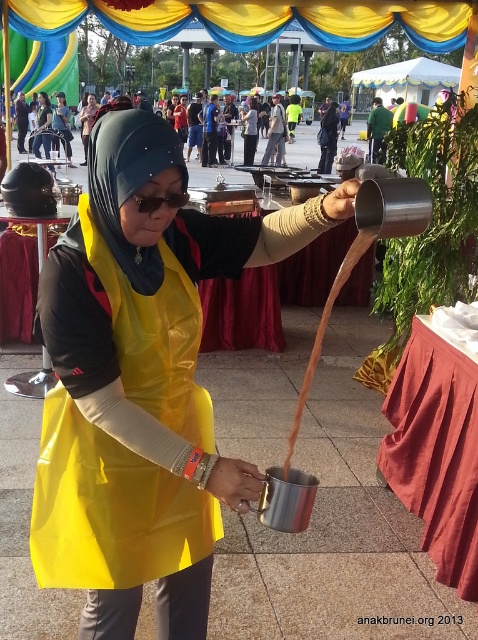
You are a guest at the event and want to approach the server wearing the metallic yellow apron at center. Which direction should you move relative to the yellow matte apron at center?

The metallic yellow apron at center is to the right of the yellow matte apron at center, so you should move to the right side of the yellow matte apron at center to reach the server.

You are a guest at this event and want to approach the server wearing the metallic yellow apron at center. There is a yellow fabric at center in your path. Which object should you move around to reach the server?

You should move around the yellow fabric at center because the metallic yellow apron at center is closer to you, so the yellow fabric at center is in your way and needs to be navigated around to reach the server.